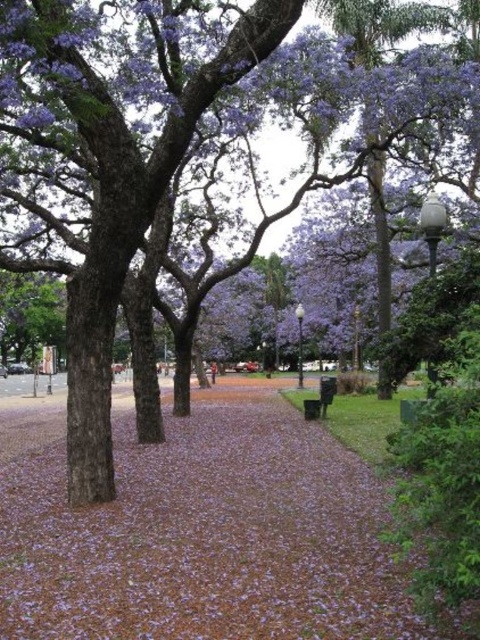
You are a park visitor who wants to sit on the black plastic bench at center. As you walk along the pathway, you notice purple matte petals at center. Which direction should you move to reach the bench from the petals?

The purple matte petals at center are to the left of the black plastic bench at center. Therefore, you should move to the right to reach the bench from the petals.

You are a gardener who needs to place a new decorative statue that is 1.2 meters tall on the black plastic bench at center. Can the statue be placed there without exceeding the height of the purple matte petals at center?

The purple matte petals at center is taller than the black plastic bench at center, so placing a 1.2 meter tall statue on the bench would make the statue taller than the petals. Therefore, the statue would exceed the height of the purple matte petals at center.